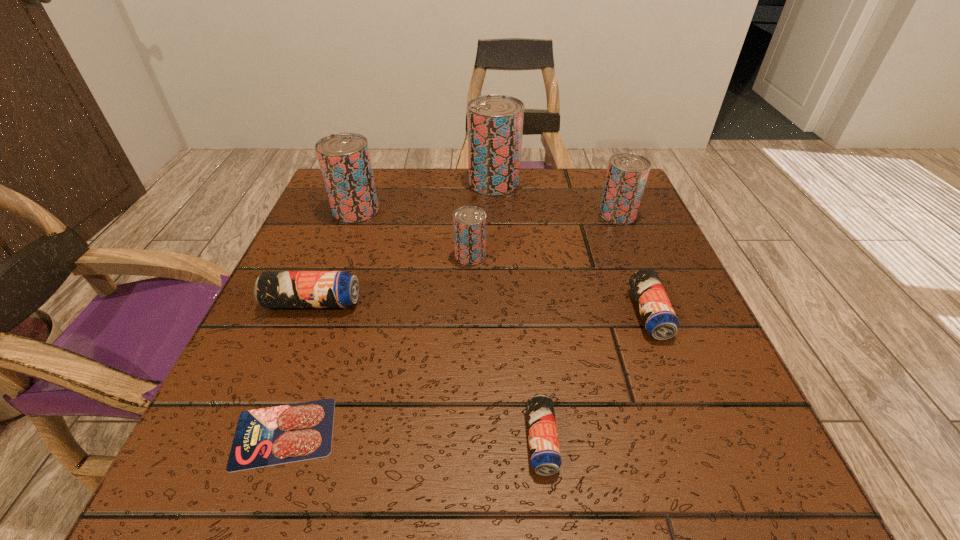
The width and height of the screenshot is (960, 540). In the image, there is a desktop. In order to click on vacant space at the near edge in this screenshot , I will do `click(654, 489)`.

The height and width of the screenshot is (540, 960). Find the location of `free space at the left edge of the desktop`. free space at the left edge of the desktop is located at coordinates (362, 271).

Find the location of `vacant space at the right edge of the desktop`. vacant space at the right edge of the desktop is located at coordinates (630, 235).

Locate an element on the screen. The height and width of the screenshot is (540, 960). vacant area at the far left corner is located at coordinates (384, 173).

Where is `free location at the far right corner`? Image resolution: width=960 pixels, height=540 pixels. free location at the far right corner is located at coordinates (647, 210).

Locate an element on the screen. This screenshot has width=960, height=540. empty space that is in between the third shortest beer can and the shortest object is located at coordinates (299, 368).

You are a GUI agent. You are given a task and a screenshot of the screen. Output one action in this format:
    pyautogui.click(x=<x>, y=<y>)
    Task: Click on the unoccupied area between the second biggest red beer can and the rightmost red beer can
    The image size is (960, 540).
    Given the screenshot: What is the action you would take?
    pyautogui.click(x=487, y=212)

Where is `vacant space that's between the shortest object and the rightmost blue beer can`? The width and height of the screenshot is (960, 540). vacant space that's between the shortest object and the rightmost blue beer can is located at coordinates (467, 373).

Where is `empty space between the leftmost red beer can and the farthest beer can`? The width and height of the screenshot is (960, 540). empty space between the leftmost red beer can and the farthest beer can is located at coordinates (425, 197).

Find the location of `free space between the shortest object and the fourth shortest object`. free space between the shortest object and the fourth shortest object is located at coordinates pyautogui.click(x=299, y=368).